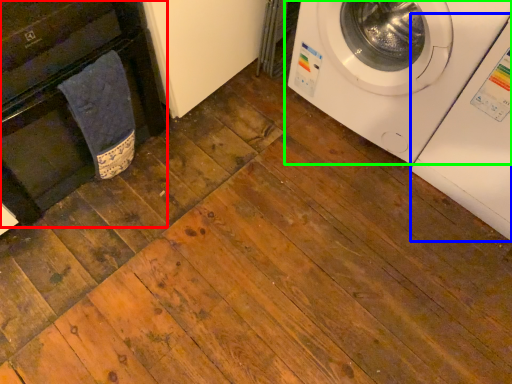
Question: Which object is the closest to the dish washer (highlighted by a red box)? Choose among these: washing machine (highlighted by a blue box) or washing machine (highlighted by a green box).

Choices:
 (A) washing machine
 (B) washing machine

Answer: (B)